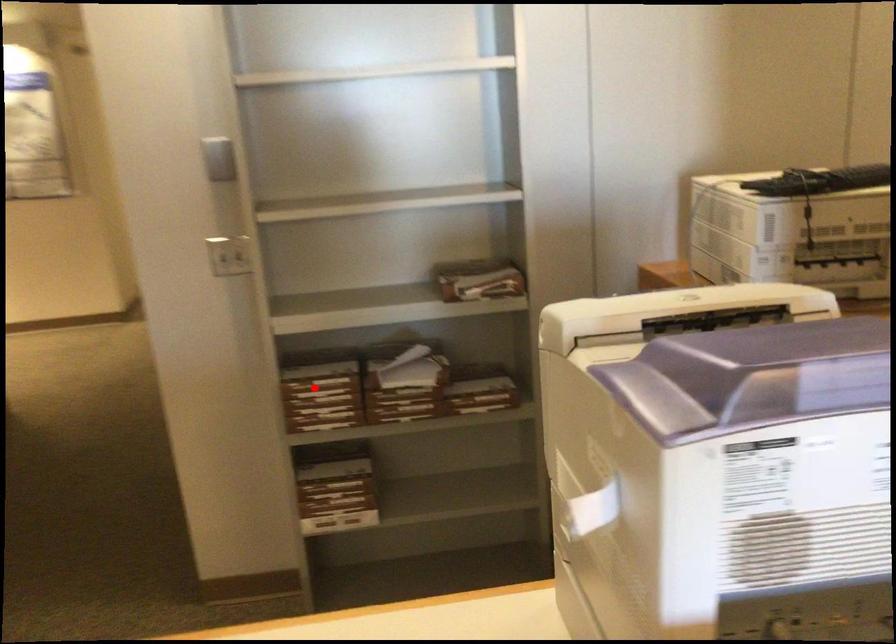
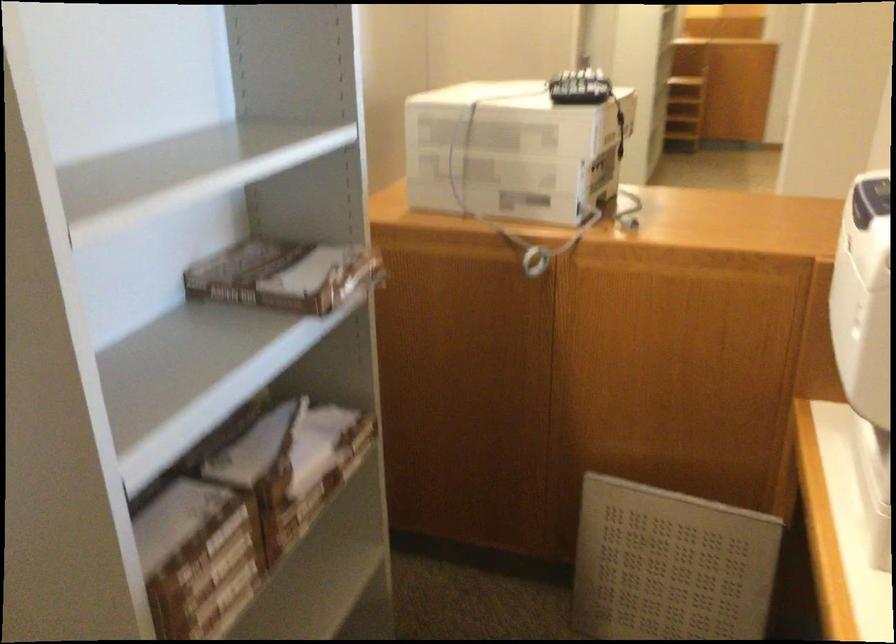
Find the pixel in the second image that matches the highlighted location in the first image.

(209, 556)